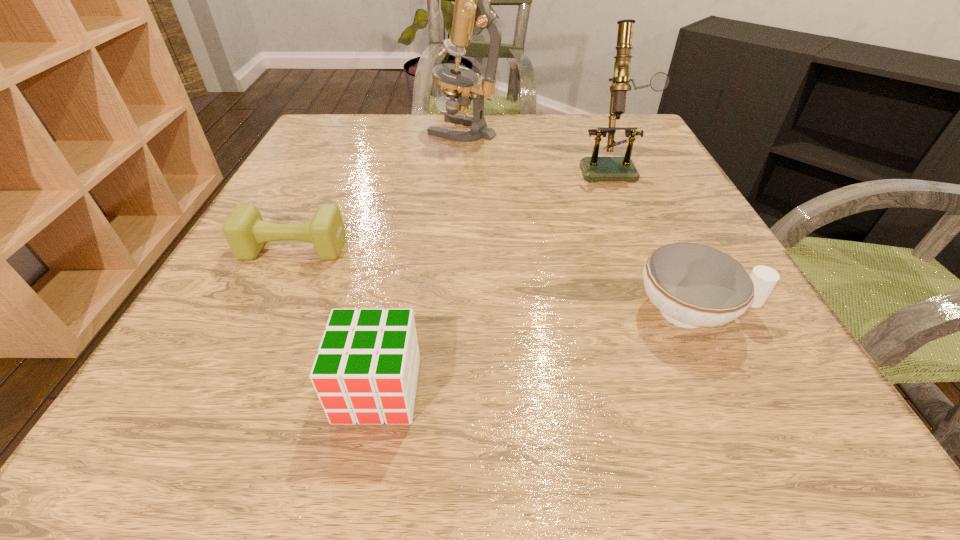
In order to click on free space between the second nearest object and the nearer microscope in this screenshot , I will do `click(653, 239)`.

Where is `free space between the taller microscope and the third shortest object`? This screenshot has width=960, height=540. free space between the taller microscope and the third shortest object is located at coordinates click(420, 260).

Find the location of a particular element. This screenshot has width=960, height=540. vacant point located between the fourth farthest object and the tallest object is located at coordinates (x=579, y=221).

This screenshot has height=540, width=960. Identify the location of vacant region between the second tallest object and the nearest object. (494, 278).

You are a GUI agent. You are given a task and a screenshot of the screen. Output one action in this format:
    pyautogui.click(x=<x>, y=<y>)
    Task: Click on the object identified as the third closest to the nearest object
    This screenshot has height=540, width=960.
    Given the screenshot: What is the action you would take?
    pyautogui.click(x=594, y=168)

Identify the location of the fourth closest object relative to the dumbbell. Image resolution: width=960 pixels, height=540 pixels. (594, 168).

In order to click on free space that satisfies the following two spatial constraints: 1. on the side with the handle of the chinaware; 2. on the red face of the third shortest object in this screenshot , I will do [732, 389].

Where is `free space that satisfies the following two spatial constraints: 1. on the side with the handle of the chinaware; 2. on the red face of the third shortest object`? free space that satisfies the following two spatial constraints: 1. on the side with the handle of the chinaware; 2. on the red face of the third shortest object is located at coordinates (732, 389).